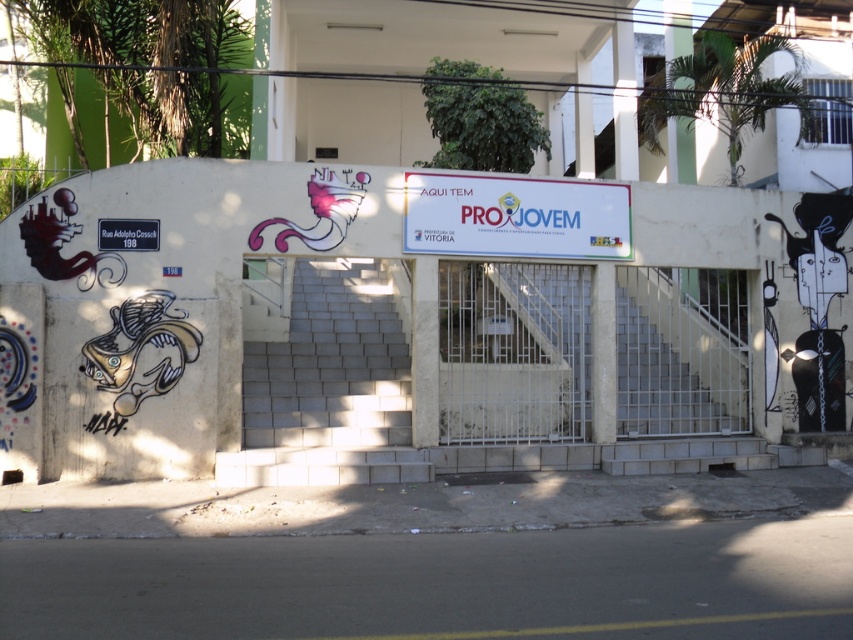
You are standing at the entrance of the building and want to move from the point at coordinates point (x=421, y=240) to point (x=148, y=248). Which direction should you move to reach your destination?

To move from point (x=421, y=240) to point (x=148, y=248), you should move downward since point (x=148, y=248) is lower than point (x=421, y=240).

You are a delivery driver who needs to read both the white plastic sign at center and the white matte street sign at left at the entrance of this building. Which sign should you look at first if you want to see the larger one?

The white plastic sign at center is bigger than the white matte street sign at left, so you should look at the white plastic sign at center first.

You are a delivery person approaching the entrance of the building. You need to place a package on the ground between the white plastic sign at center and the white matte street sign at left. The package requires a minimum of 3 meters of space between the two signs to fit. Can you place the package there?

The white plastic sign at center is 3.72 meters away from the white matte street sign at left. Since the required space is 3 meters and the actual distance is 3.72 meters, the package can be placed between them as there is enough space.